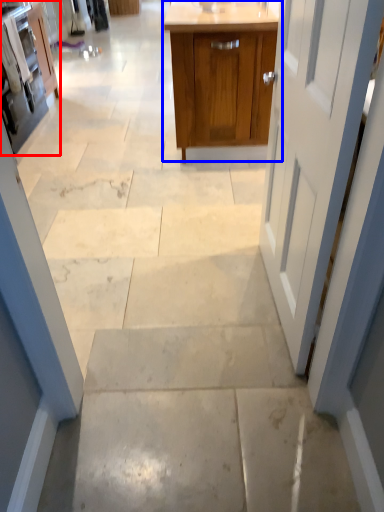
Question: Which point is closer to the camera, cabinetry (highlighted by a red box) or cabinetry (highlighted by a blue box)?

Choices:
 (A) cabinetry
 (B) cabinetry

Answer: (B)